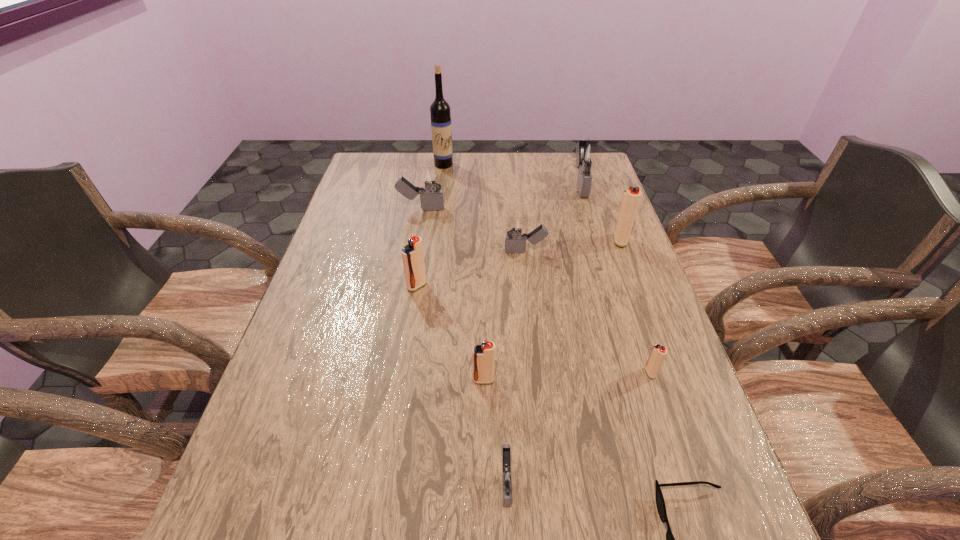
This screenshot has width=960, height=540. What are the coordinates of `igniter object that ranks as the seventh closest to the ninth nearest object` in the screenshot? It's located at (505, 477).

Where is `the fourth closest igniter to the fifth nearest object`? This screenshot has height=540, width=960. the fourth closest igniter to the fifth nearest object is located at coordinates (505, 477).

Find the location of `the closest red igniter to the second farthest igniter`. the closest red igniter to the second farthest igniter is located at coordinates (412, 254).

Locate which red igniter is the closest to the farthest red igniter. Please provide its 2D coordinates. Your answer should be formatted as a tuple, i.e. [(x, y)], where the tuple contains the x and y coordinates of a point satisfying the conditions above.

[(658, 353)]

Select which gray igniter is the third closest to the sunglasses. Please provide its 2D coordinates. Your answer should be formatted as a tuple, i.e. [(x, y)], where the tuple contains the x and y coordinates of a point satisfying the conditions above.

[(588, 154)]

Locate an element on the screen. The image size is (960, 540). gray igniter that stands as the second closest to the second biggest gray igniter is located at coordinates (588, 154).

This screenshot has width=960, height=540. Find the location of `vacant area in the image that satisfies the following two spatial constraints: 1. on the front side of the leftmost red igniter; 2. on the left side of the second smallest red igniter`. vacant area in the image that satisfies the following two spatial constraints: 1. on the front side of the leftmost red igniter; 2. on the left side of the second smallest red igniter is located at coordinates (403, 380).

Locate an element on the screen. The width and height of the screenshot is (960, 540). blank space that satisfies the following two spatial constraints: 1. on the label of the smallest red igniter; 2. on the left side of the tallest object is located at coordinates (419, 373).

This screenshot has height=540, width=960. I want to click on free space that satisfies the following two spatial constraints: 1. on the back side of the third farthest gray igniter; 2. on the right side of the third biggest red igniter, so click(x=483, y=252).